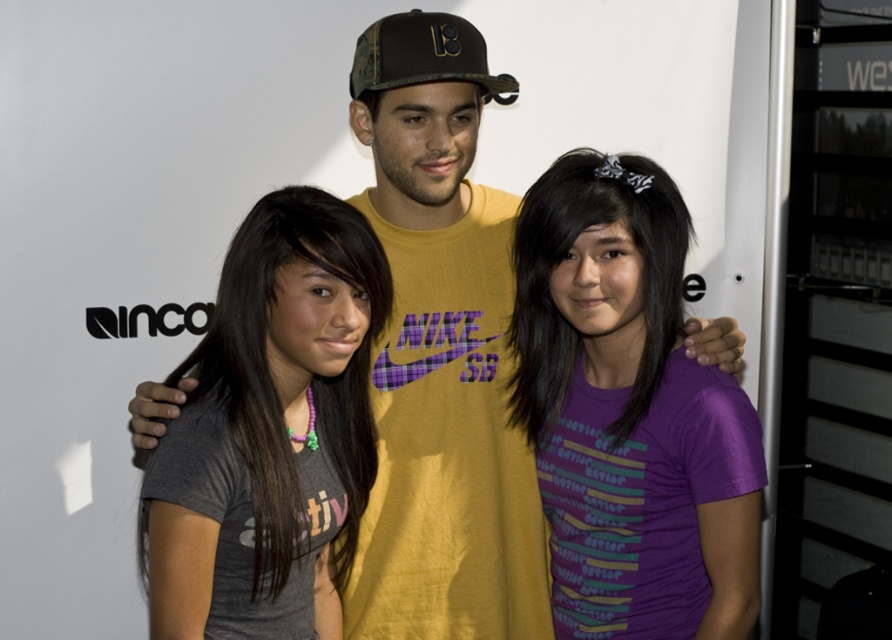
Question: From the image, what is the correct spatial relationship of yellow cotton t-shirt at center in relation to camouflage fabric baseball cap at center?

Choices:
 (A) below
 (B) above

Answer: (A)

Question: Which point appears closest to the camera in this image?

Choices:
 (A) (294, 328)
 (B) (628, 264)

Answer: (A)

Question: Which of the following is the farthest from the observer?

Choices:
 (A) (550, 433)
 (B) (537, 499)

Answer: (B)

Question: Where is purple printed shirt at center located in relation to camouflage fabric baseball cap at center in the image?

Choices:
 (A) above
 (B) below

Answer: (B)

Question: Among these objects, which one is farthest from the camera?

Choices:
 (A) camouflage fabric baseball cap at center
 (B) purple printed shirt at center

Answer: (A)

Question: From the image, what is the correct spatial relationship of yellow cotton t-shirt at center in relation to purple printed shirt at center?

Choices:
 (A) left
 (B) right

Answer: (A)